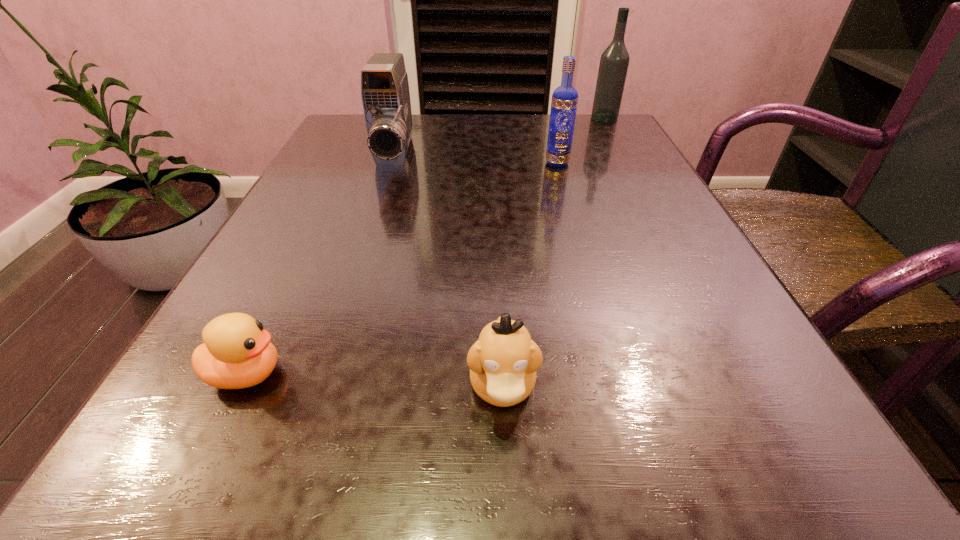
You are a GUI agent. You are given a task and a screenshot of the screen. Output one action in this format:
    pyautogui.click(x=<x>, y=<y>)
    Task: Click on the empty space between the left duckling and the third object from right to left
    This screenshot has width=960, height=540.
    Given the screenshot: What is the action you would take?
    pyautogui.click(x=374, y=380)

Locate an element on the screen. empty space between the camcorder and the left duckling is located at coordinates (321, 265).

Locate an element on the screen. free space between the fourth object from right to left and the shortest object is located at coordinates (321, 265).

Find the location of `unoccupied area between the farther vodka and the third object from right to left`. unoccupied area between the farther vodka and the third object from right to left is located at coordinates (553, 253).

What are the coordinates of `object that can be found as the closest to the leftmost object` in the screenshot? It's located at (503, 362).

Identify the location of object that stands as the closest to the right vodka. The width and height of the screenshot is (960, 540). (564, 102).

I want to click on vacant region that satisfies the following two spatial constraints: 1. at the front of the left vodka, highlighting the lens; 2. on the right side of the second object from left to right, so click(393, 163).

Identify the location of vacant position in the image that satisfies the following two spatial constraints: 1. at the front of the fourth object from right to left, highlighting the lens; 2. on the face of the leftmost object. (324, 374).

Where is `vacant region that satisfies the following two spatial constraints: 1. at the front of the left vodka, highlighting the lens; 2. on the right side of the second object from left to right`? vacant region that satisfies the following two spatial constraints: 1. at the front of the left vodka, highlighting the lens; 2. on the right side of the second object from left to right is located at coordinates (393, 163).

The width and height of the screenshot is (960, 540). In order to click on free spot that satisfies the following two spatial constraints: 1. at the front of the camcorder, highlighting the lens; 2. on the face of the shorter duckling in this screenshot , I will do `click(324, 374)`.